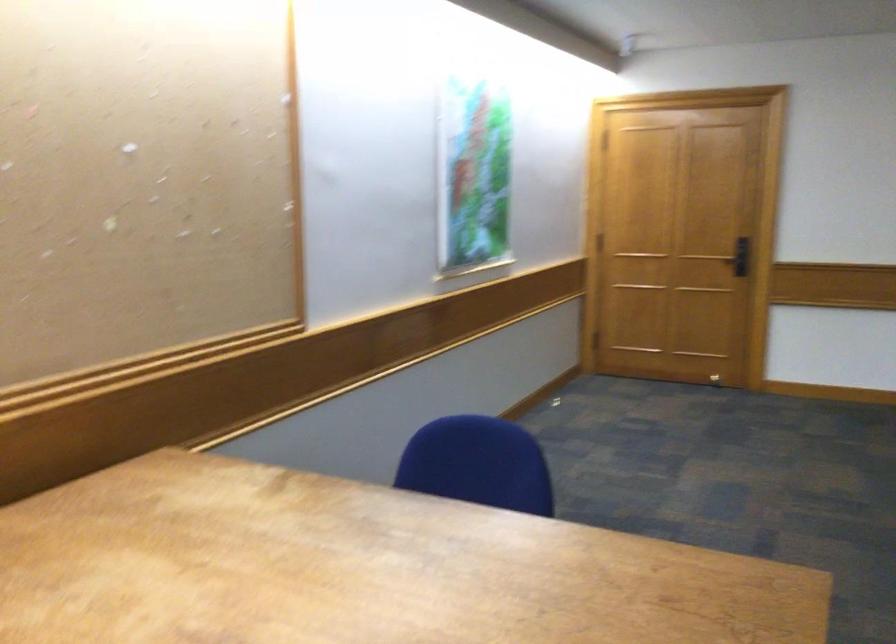
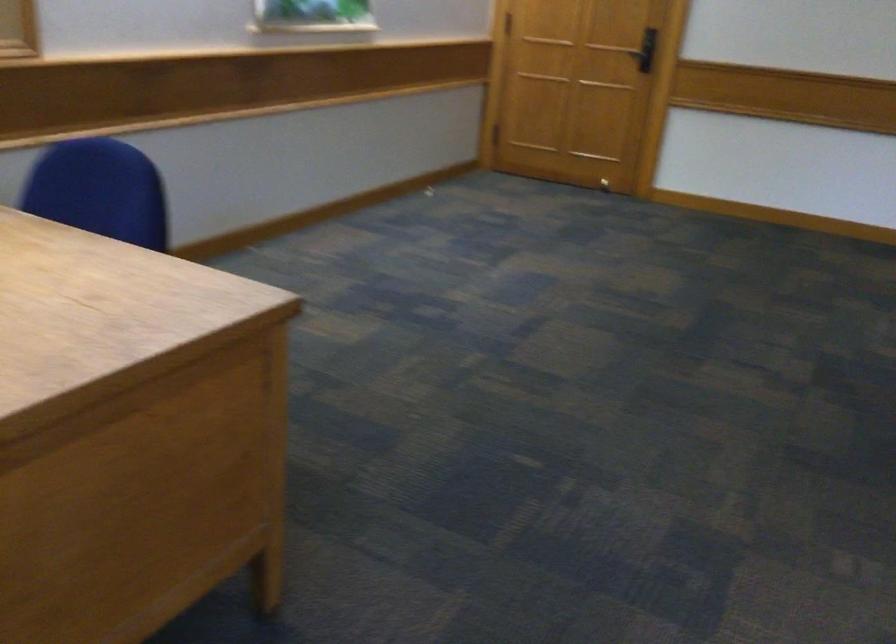
Question: The images are taken continuously from a first-person perspective. In which direction is your viewpoint rotating?

Choices:
 (A) Left
 (B) Right
 (C) Up
 (D) Down

Answer: (D)